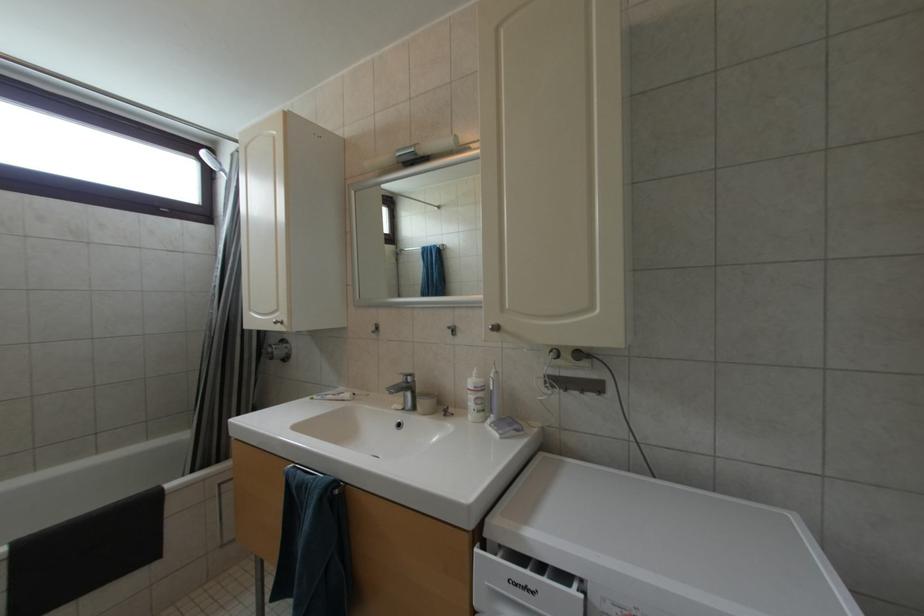
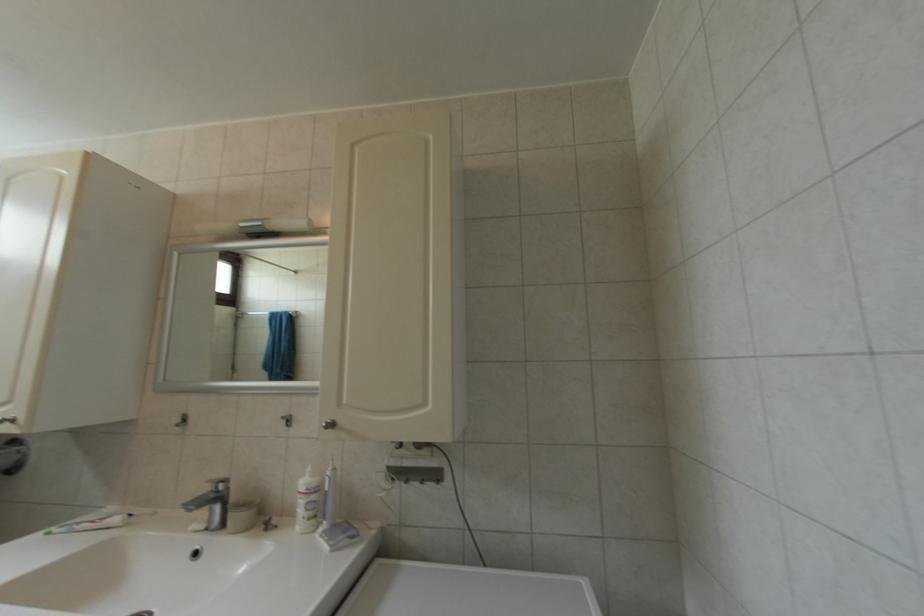
Question: How did the camera likely rotate?

Choices:
 (A) Left
 (B) Right
 (C) Up
 (D) Down

Answer: (B)